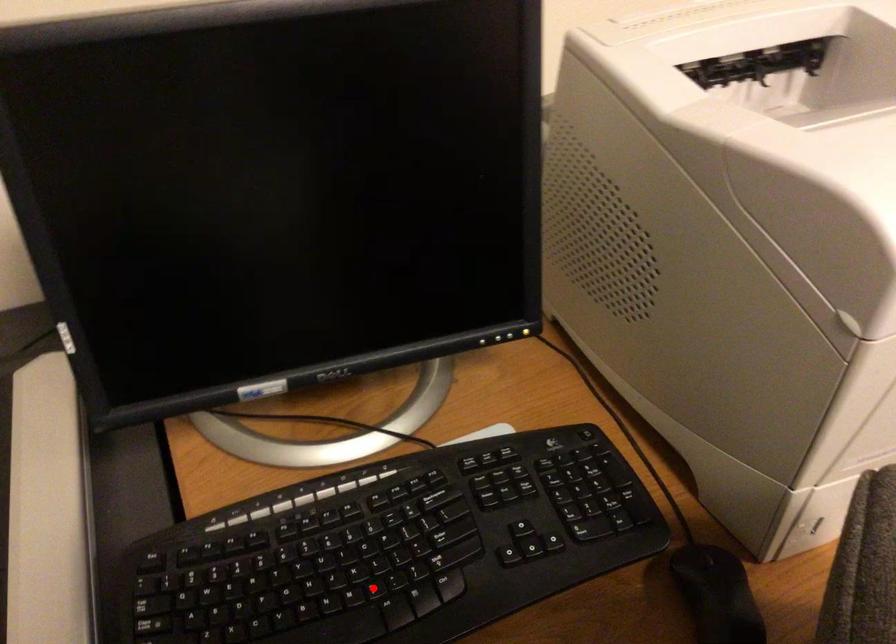
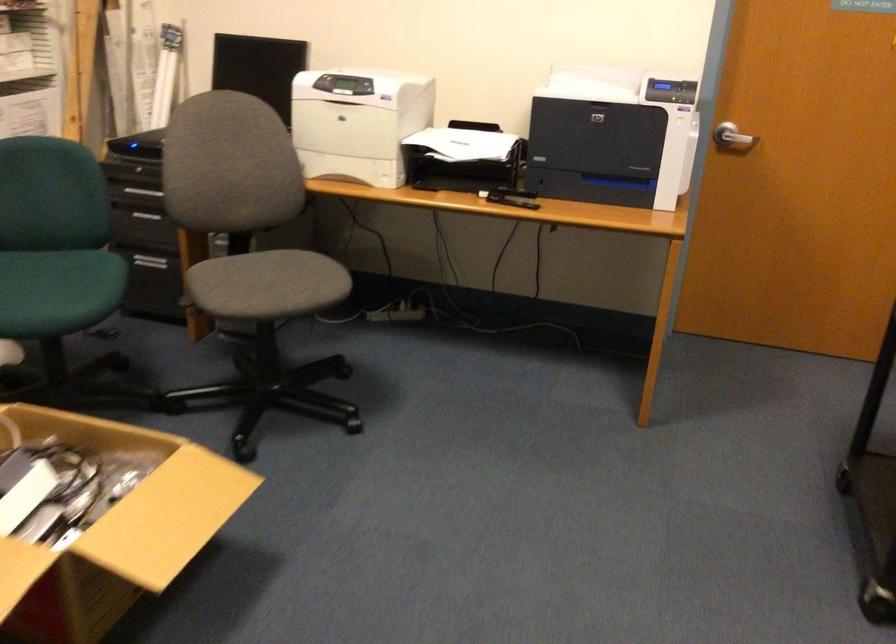
Question: I am providing you with two images of the same scene from different viewpoints. A red point is marked on the first image. Is the red point's position out of view in image 2?

Choices:
 (A) Yes
 (B) No

Answer: (A)